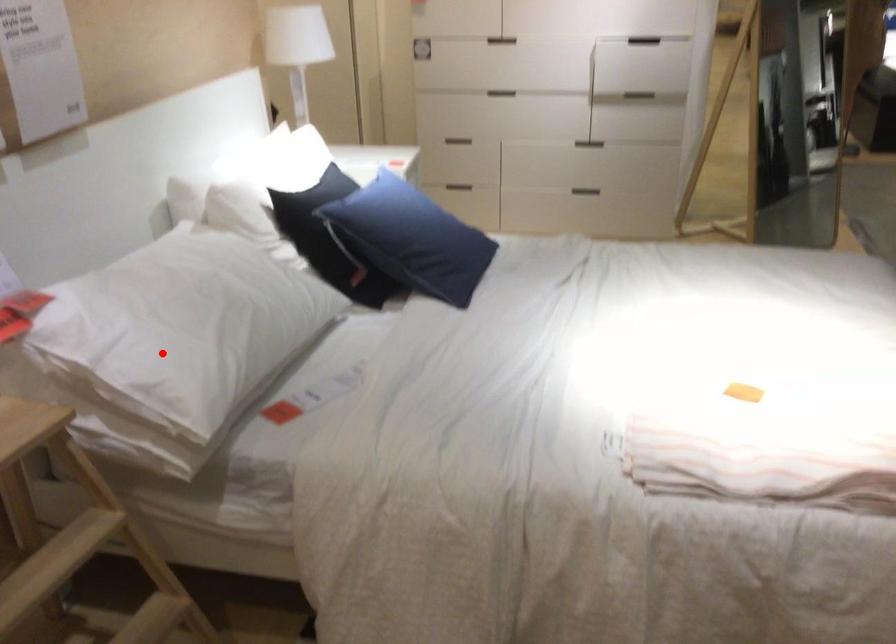
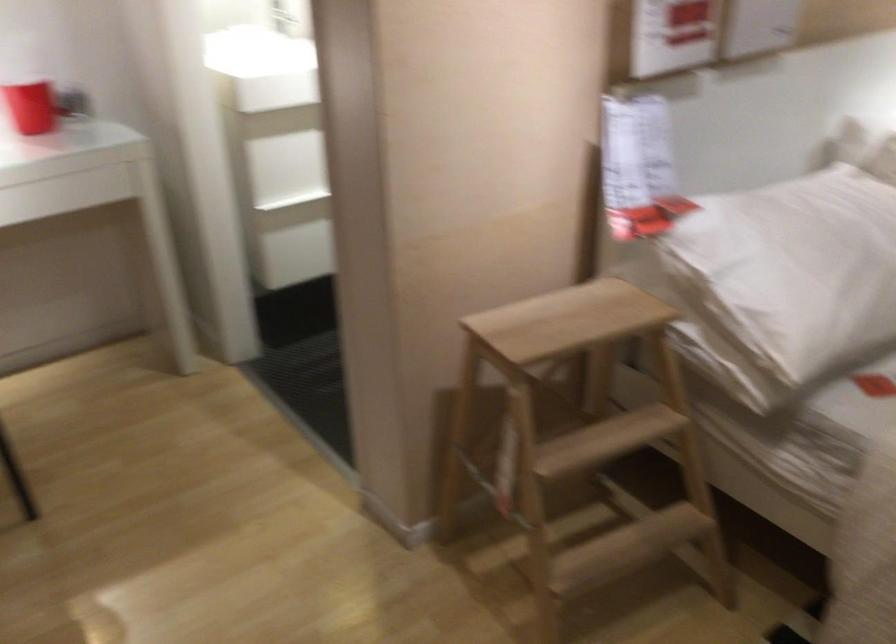
Find the pixel in the second image that matches the highlighted location in the first image.

(785, 281)